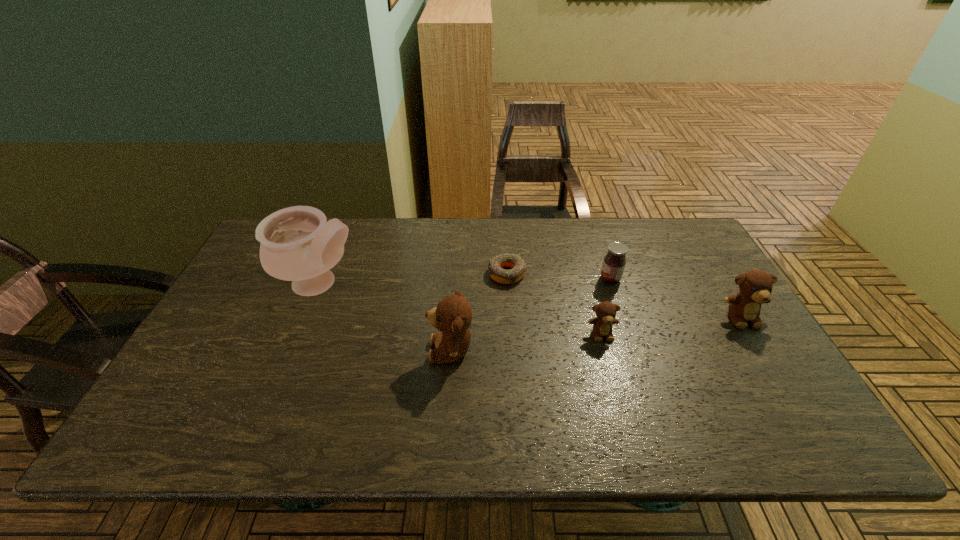
You are a GUI agent. You are given a task and a screenshot of the screen. Output one action in this format:
    pyautogui.click(x=<x>, y=<y>)
    Task: Click on the object located in the far edge section of the desktop
    The image size is (960, 540).
    Given the screenshot: What is the action you would take?
    pyautogui.click(x=297, y=244)

This screenshot has width=960, height=540. I want to click on object located at the left edge, so click(297, 244).

Find the location of `object at the right edge`. object at the right edge is located at coordinates (755, 286).

This screenshot has width=960, height=540. I want to click on object that is at the far left corner, so click(297, 244).

In the image, there is a desktop. At what (x,y) coordinates should I click in order to perform the action: click on free space at the far edge. Please return your answer as a coordinate pair (x, y). This screenshot has width=960, height=540. Looking at the image, I should click on (613, 240).

The image size is (960, 540). Identify the location of free space at the near edge. (697, 382).

In the image, there is a desktop. Identify the location of free space at the left edge. (241, 308).

In the image, there is a desktop. Where is `free space at the right edge`? This screenshot has width=960, height=540. free space at the right edge is located at coordinates (708, 355).

Locate an element on the screen. This screenshot has width=960, height=540. vacant area that lies between the shortest teddy bear and the doughnut is located at coordinates (555, 303).

The image size is (960, 540). I want to click on empty location between the leftmost teddy bear and the shortest teddy bear, so click(526, 342).